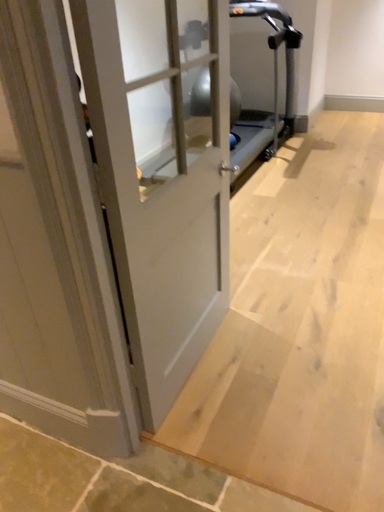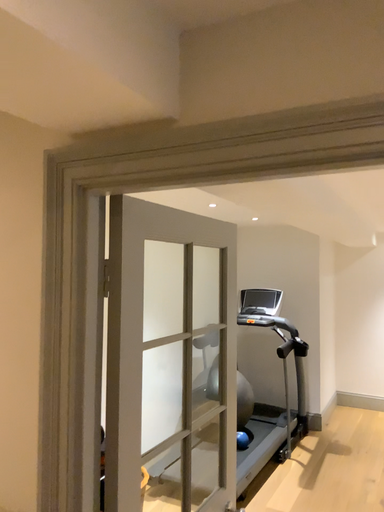
Question: Which way did the camera rotate in the video?

Choices:
 (A) rotated downward
 (B) rotated upward

Answer: (B)